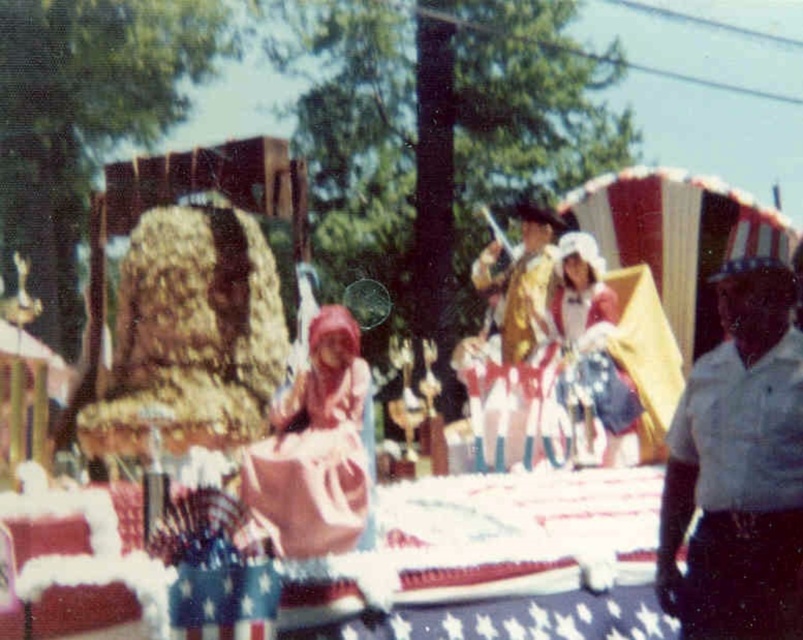
Which is more to the right, white uniform at right or pink satin dress at center?

white uniform at right

Locate an element on the screen. The height and width of the screenshot is (640, 803). white uniform at right is located at coordinates (738, 472).

Does pink satin dress at center have a greater height compared to white satin dress at center?

Incorrect, pink satin dress at center's height is not larger of white satin dress at center's.

From the picture: Can you confirm if pink satin dress at center is shorter than white satin dress at center?

Yes, pink satin dress at center is shorter than white satin dress at center.

Is point (353, 323) positioned after point (596, 342)?

That is False.

Locate an element on the screen. This screenshot has height=640, width=803. pink satin dress at center is located at coordinates (312, 451).

Which is in front, point (344, 324) or point (495, 408)?

Point (344, 324) is in front.

Is point (272, 502) in front of point (510, 268)?

Yes.

Locate an element on the screen. This screenshot has height=640, width=803. pink satin dress at center is located at coordinates (312, 451).